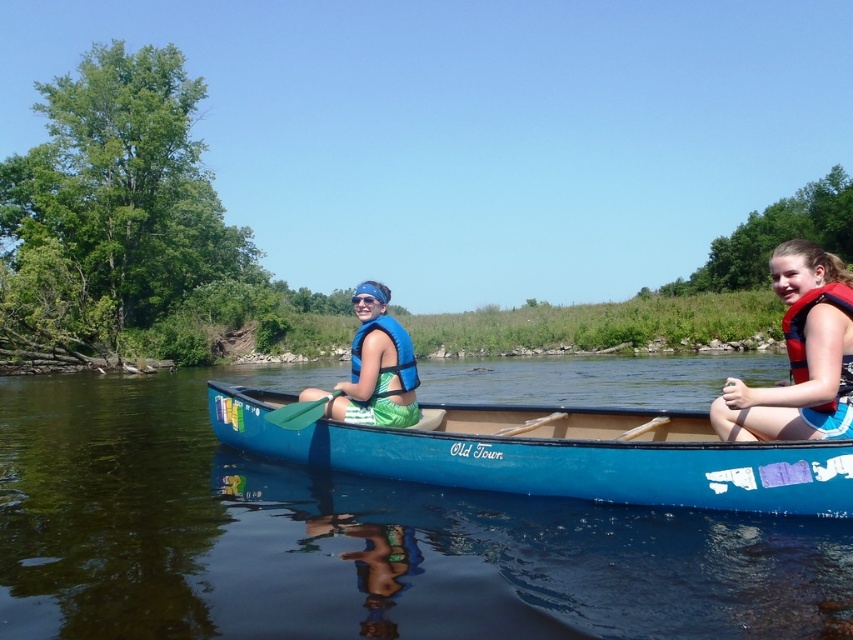
Question: Can you confirm if blue wood canoe at center is positioned to the right of orange life jacket at right?

Choices:
 (A) yes
 (B) no

Answer: (B)

Question: Which point is farther to the camera?

Choices:
 (A) red life vest at right
 (B) orange life jacket at right

Answer: (B)

Question: Which of the following is the farthest from the observer?

Choices:
 (A) (848, 467)
 (B) (538, 420)
 (C) (369, 324)

Answer: (B)

Question: Which point appears farthest from the camera in this image?

Choices:
 (A) (364, 419)
 (B) (312, 406)

Answer: (B)

Question: Observing the image, what is the correct spatial positioning of blue wood canoe at center in reference to white wood paddle at center?

Choices:
 (A) left
 (B) right

Answer: (A)

Question: Does blue plastic canoe at center appear over blue wood canoe at center?

Choices:
 (A) no
 (B) yes

Answer: (A)